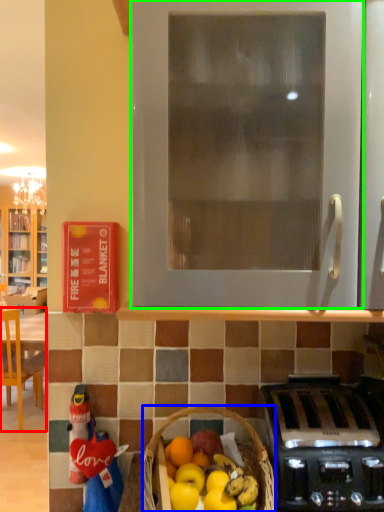
Question: Which is farther away from chair (highlighted by a red box)? picnic basket (highlighted by a blue box) or oven (highlighted by a green box)?

Choices:
 (A) picnic basket
 (B) oven

Answer: (B)